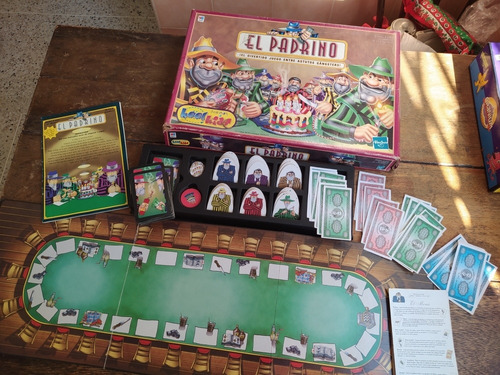
This screenshot has width=500, height=375. What are the coordinates of `board game box` in the screenshot? It's located at (491, 100), (331, 93).